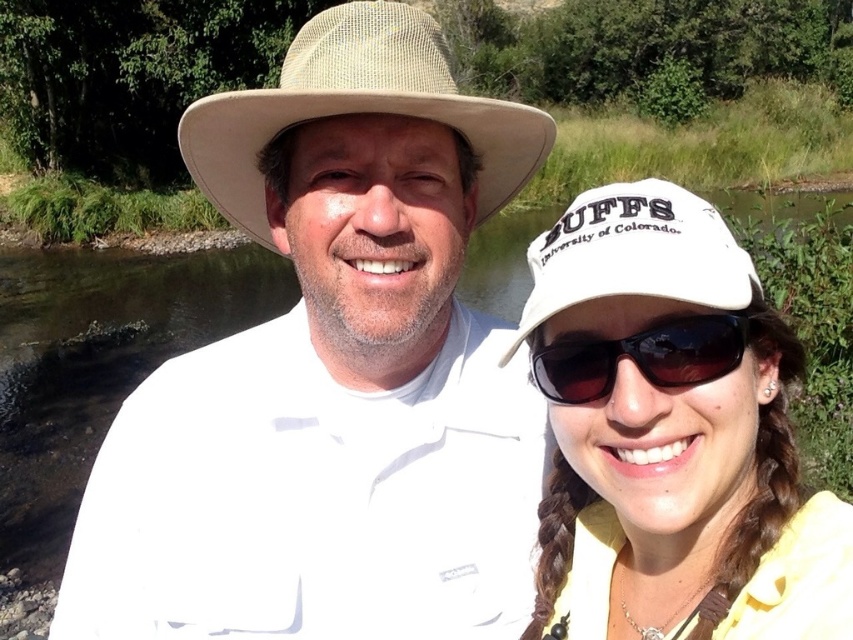
Which is in front, point (637, 497) or point (691, 348)?

Point (691, 348)

Is white fabric cap at upper right to the left of black reflective sunglasses at center from the viewer's perspective?

In fact, white fabric cap at upper right is to the right of black reflective sunglasses at center.

Is point (573, 516) less distant than point (654, 339)?

That is False.

The width and height of the screenshot is (853, 640). Identify the location of white fabric cap at upper right. (671, 435).

Based on the photo, can you confirm if white woven hat at upper center is smaller than clear water at creek center?

Correct, white woven hat at upper center occupies less space than clear water at creek center.

What do you see at coordinates (332, 374) in the screenshot?
I see `white woven hat at upper center` at bounding box center [332, 374].

Where is `white woven hat at upper center`? This screenshot has width=853, height=640. white woven hat at upper center is located at coordinates [x=332, y=374].

Can you confirm if clear water at creek center is thinner than beige straw cowboy hat at upper center?

In fact, clear water at creek center might be wider than beige straw cowboy hat at upper center.

The height and width of the screenshot is (640, 853). Find the location of `clear water at creek center`. clear water at creek center is located at coordinates (97, 364).